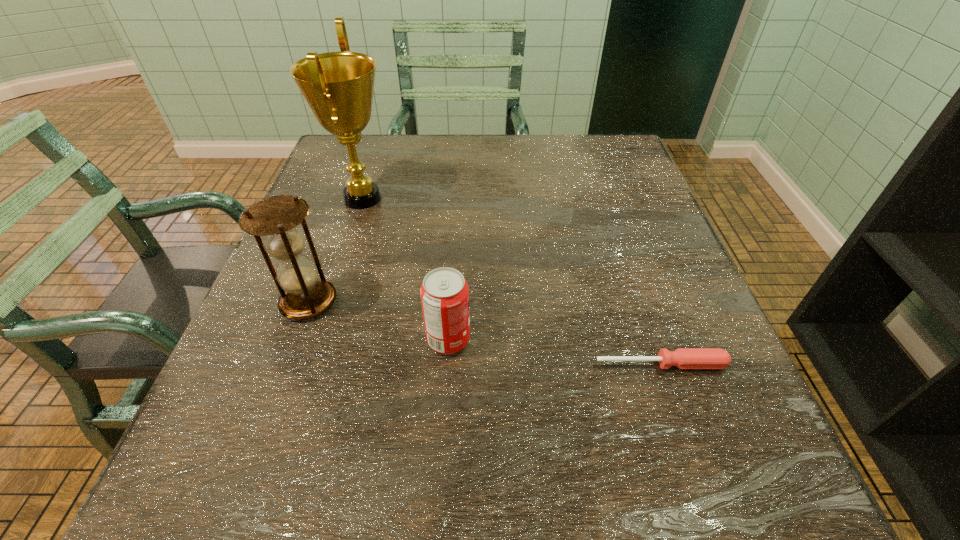
This screenshot has height=540, width=960. I want to click on vacant space in between the second object from right to left and the shortest object, so click(555, 352).

Identify the location of free space between the farthest object and the screwdriver. (512, 281).

At what (x,y) coordinates should I click in order to perform the action: click on empty space between the award and the third tallest object. Please return your answer as a coordinate pair (x, y). This screenshot has height=540, width=960. Looking at the image, I should click on [x=405, y=269].

Identify which object is the third nearest to the second object from right to left. Please provide its 2D coordinates. Your answer should be formatted as a tuple, i.e. [(x, y)], where the tuple contains the x and y coordinates of a point satisfying the conditions above.

[(338, 86)]

The width and height of the screenshot is (960, 540). What are the coordinates of `object that is the third closest to the soda can` in the screenshot? It's located at (338, 86).

Find the location of `vacant area that satisfies the following two spatial constraints: 1. on the front view with handles of the farthest object; 2. on the left side of the screwdriver`. vacant area that satisfies the following two spatial constraints: 1. on the front view with handles of the farthest object; 2. on the left side of the screwdriver is located at coordinates (309, 364).

Where is `vacant position in the image that satisfies the following two spatial constraints: 1. on the front view with handles of the tallest object; 2. on the front side of the second tallest object`? The image size is (960, 540). vacant position in the image that satisfies the following two spatial constraints: 1. on the front view with handles of the tallest object; 2. on the front side of the second tallest object is located at coordinates (329, 301).

At what (x,y) coordinates should I click in order to perform the action: click on free region that satisfies the following two spatial constraints: 1. on the back side of the second object from right to left; 2. on the front view with handles of the award. Please return your answer as a coordinate pair (x, y). The height and width of the screenshot is (540, 960). Looking at the image, I should click on (457, 198).

Locate an element on the screen. This screenshot has width=960, height=540. vacant region that satisfies the following two spatial constraints: 1. on the front side of the second shortest object; 2. on the left side of the hourglass is located at coordinates (295, 340).

The image size is (960, 540). Identify the location of free space that satisfies the following two spatial constraints: 1. on the front side of the second shortest object; 2. on the right side of the shortest object. (447, 364).